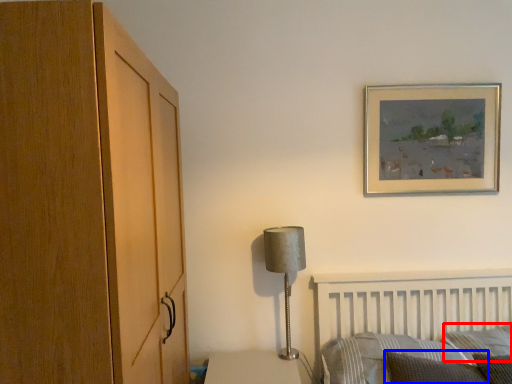
Question: Among these objects, which one is nearest to the camera, pillow (highlighted by a red box) or pillow (highlighted by a blue box)?

Choices:
 (A) pillow
 (B) pillow

Answer: (B)